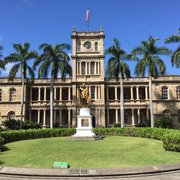
At what (x,y) coordinates should I click in order to perform the action: click on 1 clock. Please return your answer as a coordinate pair (x, y). The width and height of the screenshot is (180, 180). Looking at the image, I should click on (84, 46).